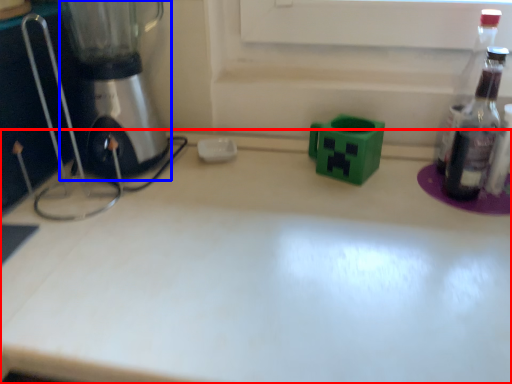
Question: Which object is further to the camera taking this photo, countertop (highlighted by a red box) or mixer (highlighted by a blue box)?

Choices:
 (A) countertop
 (B) mixer

Answer: (B)